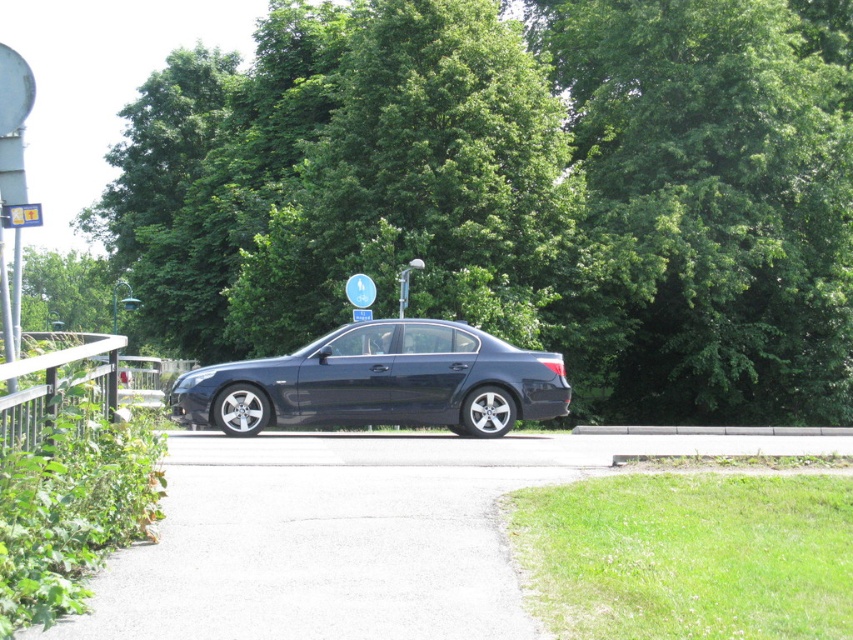
You are a driver who just arrived at this parking area and need to park your car. You notice a green leafy tree at center and a black metal rail at left. Which object is taller and could potentially block your view while backing out of the parking spot?

The green leafy tree at center is much taller than the black metal rail at left, so it could potentially block your view while backing out of the parking spot.

You are a pedestrian standing on the sidewalk and see the black metal rail at left and the green leafy tree at upper center. Which object is closer to the ground?

The black metal rail at left is located below the green leafy tree at upper center, so it is closer to the ground.

You are a delivery person with a 10 feet wide cart. You need to pass between the black metal rail at left and the blue plastic sign at center. Can your cart fit through the space between them?

The black metal rail at left and blue plastic sign at center are 22.29 feet apart from each other. Since your cart is 10 feet wide, it can easily fit through the space between them as 22.29 feet is wider than 10 feet.